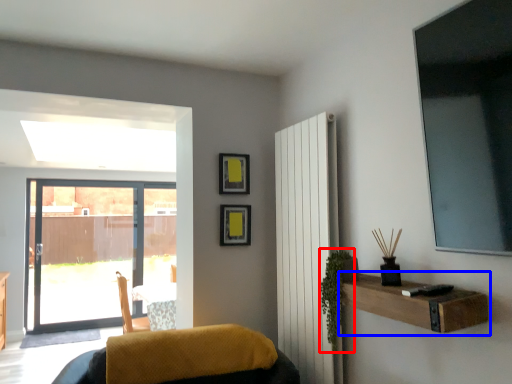
Question: Which point is further to the camera, plant (highlighted by a red box) or shelf (highlighted by a blue box)?

Choices:
 (A) plant
 (B) shelf

Answer: (A)